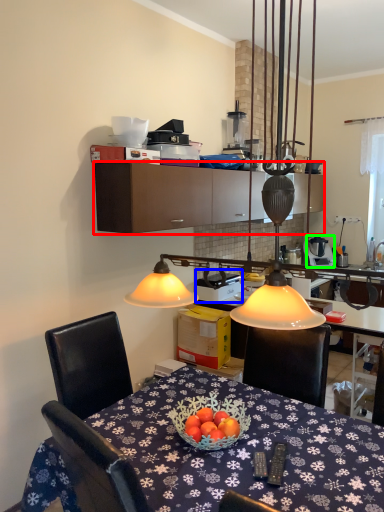
Question: Considering the real-world distances, which object is farthest from cabinetry (highlighted by a red box)? appliance (highlighted by a blue box) or appliance (highlighted by a green box)?

Choices:
 (A) appliance
 (B) appliance

Answer: (B)